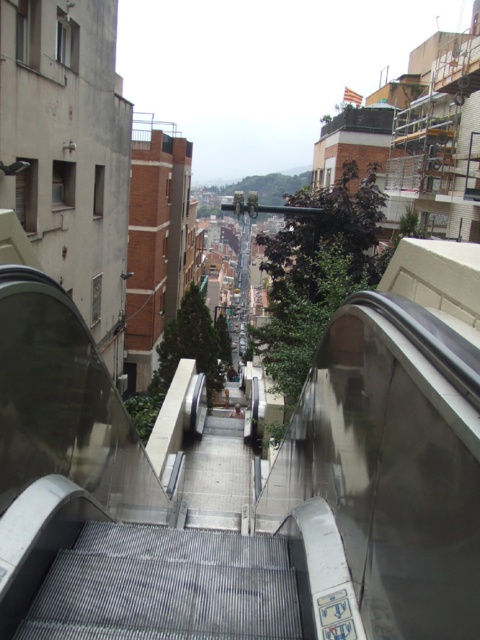
You are standing on the top of the metallic gray escalator at center and want to walk down to the street below. However, you notice there is also a set of metallic gray stairs at center nearby. Which path would require descending more steps?

The metallic gray escalator at center is much taller than the metallic gray stairs at center, so descending the metallic gray escalator at center would require more steps than the stairs.

You are standing on the top of the escalator and want to walk to the point marked as point (167, 586). Is this point located on the metallic gray escalator at center?

Yes, the point (167, 586) is on the metallic gray escalator at center, so you can walk to it directly.